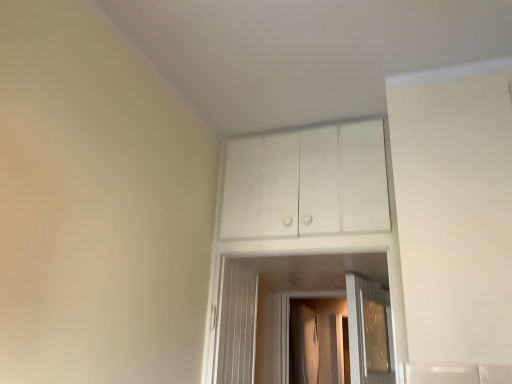
The width and height of the screenshot is (512, 384). What do you see at coordinates (317, 341) in the screenshot?
I see `transparent plastic screen door at center` at bounding box center [317, 341].

This screenshot has height=384, width=512. What are the coordinates of `transparent plastic screen door at center` in the screenshot? It's located at (317, 341).

Find the location of `white matte cabinet at upper center`. white matte cabinet at upper center is located at coordinates (306, 183).

What do you see at coordinates (306, 183) in the screenshot?
I see `white matte cabinet at upper center` at bounding box center [306, 183].

Where is `transparent plastic screen door at center`? This screenshot has width=512, height=384. transparent plastic screen door at center is located at coordinates (317, 341).

Considering the relative positions of white matte cabinet at upper center and transparent plastic screen door at center in the image provided, is white matte cabinet at upper center to the left of transparent plastic screen door at center from the viewer's perspective?

Indeed, white matte cabinet at upper center is positioned on the left side of transparent plastic screen door at center.

Is the position of white matte cabinet at upper center less distant than that of transparent plastic screen door at center?

Yes.

Does point (234, 141) appear closer or farther from the camera than point (341, 317)?

Point (234, 141) is positioned closer to the camera compared to point (341, 317).

From the image's perspective, relative to transparent plastic screen door at center, is white matte cabinet at upper center above or below?

Based on their image positions, white matte cabinet at upper center is located above transparent plastic screen door at center.

From a real-world perspective, is white matte cabinet at upper center physically above transparent plastic screen door at center?

Yes.

Is white matte cabinet at upper center thinner than transparent plastic screen door at center?

Yes.

Does white matte cabinet at upper center have a lesser height compared to transparent plastic screen door at center?

Correct, white matte cabinet at upper center is not as tall as transparent plastic screen door at center.

Does white matte cabinet at upper center have a smaller size compared to transparent plastic screen door at center?

Correct, white matte cabinet at upper center occupies less space than transparent plastic screen door at center.

Could transparent plastic screen door at center be considered to be inside white matte cabinet at upper center?

Definitely not — transparent plastic screen door at center is not inside white matte cabinet at upper center.

From the picture: Are white matte cabinet at upper center and transparent plastic screen door at center located far from each other?

Yes.

Is white matte cabinet at upper center turned away from transparent plastic screen door at center?

Yes, white matte cabinet at upper center's orientation is away from transparent plastic screen door at center.

Can you tell me how much white matte cabinet at upper center and transparent plastic screen door at center differ in facing direction?

The angular difference between white matte cabinet at upper center and transparent plastic screen door at center is 88 degrees.

Where is `cabinetry above the transparent plastic screen door at center (from a real-world perspective)`? cabinetry above the transparent plastic screen door at center (from a real-world perspective) is located at coordinates (306, 183).

Is transparent plastic screen door at center to the right of white matte cabinet at upper center from the viewer's perspective?

Yes.

Considering the relative positions of transparent plastic screen door at center and white matte cabinet at upper center in the image provided, is transparent plastic screen door at center behind white matte cabinet at upper center?

Yes, the depth of transparent plastic screen door at center is greater than that of white matte cabinet at upper center.

Based on the photo, which point is more distant from viewer, (328, 322) or (224, 224)?

The point (328, 322) is behind.

From the image's perspective, would you say transparent plastic screen door at center is positioned over white matte cabinet at upper center?

No, from the image's perspective, transparent plastic screen door at center is not on top of white matte cabinet at upper center.

From a real-world perspective, is transparent plastic screen door at center above or below white matte cabinet at upper center?

transparent plastic screen door at center is below white matte cabinet at upper center.

Which object is wider, transparent plastic screen door at center or white matte cabinet at upper center?

transparent plastic screen door at center.

In terms of height, does transparent plastic screen door at center look taller or shorter compared to white matte cabinet at upper center?

Clearly, transparent plastic screen door at center is taller compared to white matte cabinet at upper center.

Looking at this image, considering the sizes of transparent plastic screen door at center and white matte cabinet at upper center in the image, is transparent plastic screen door at center bigger or smaller than white matte cabinet at upper center?

In the image, transparent plastic screen door at center appears to be larger than white matte cabinet at upper center.

Would you say transparent plastic screen door at center contains white matte cabinet at upper center?

Actually, white matte cabinet at upper center is outside transparent plastic screen door at center.

Is transparent plastic screen door at center next to white matte cabinet at upper center and touching it?

transparent plastic screen door at center and white matte cabinet at upper center are not in contact.

Is transparent plastic screen door at center facing away from white matte cabinet at upper center?

No.

What's the angular difference between transparent plastic screen door at center and white matte cabinet at upper center's facing directions?

There is a 88-degree angle between the facing directions of transparent plastic screen door at center and white matte cabinet at upper center.

How far apart are transparent plastic screen door at center and white matte cabinet at upper center?

transparent plastic screen door at center is 6.21 feet from white matte cabinet at upper center.

This screenshot has height=384, width=512. I want to click on cabinetry in front of the transparent plastic screen door at center, so 306,183.

The width and height of the screenshot is (512, 384). In the image, there is a transparent plastic screen door at center. Identify the location of cabinetry above it (from the image's perspective). (306, 183).

The height and width of the screenshot is (384, 512). What are the coordinates of `screen door lying on the right of white matte cabinet at upper center` in the screenshot? It's located at (317, 341).